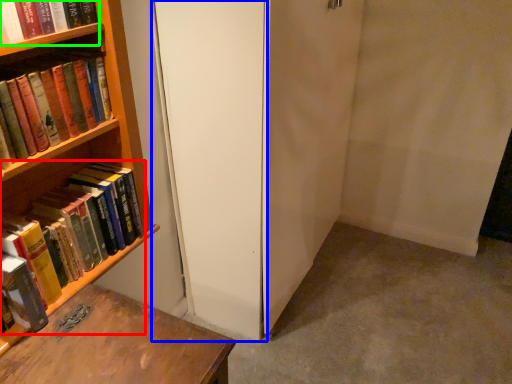
Question: Estimate the real-world distances between objects in this image. Which object is farther from book (highlighted by a red box), screen door (highlighted by a blue box) or book (highlighted by a green box)?

Choices:
 (A) screen door
 (B) book

Answer: (B)